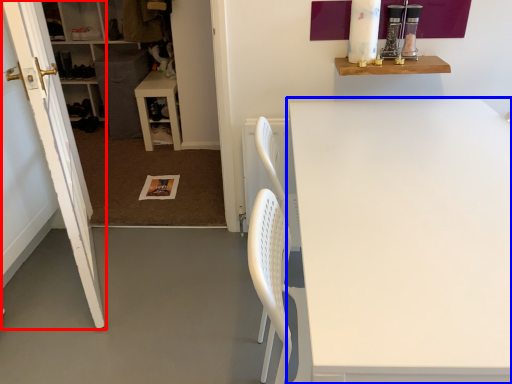
Question: Which of the following is the farthest to the observer, door (highlighted by a red box) or table (highlighted by a blue box)?

Choices:
 (A) door
 (B) table

Answer: (A)